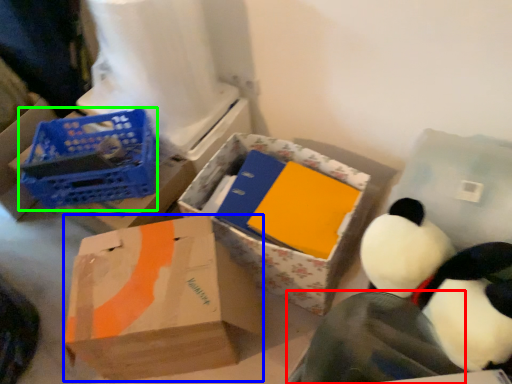
Question: Which object is the closest to the penguin (highlighted by a red box)? Choose among these: box (highlighted by a blue box) or basket (highlighted by a green box).

Choices:
 (A) box
 (B) basket

Answer: (A)